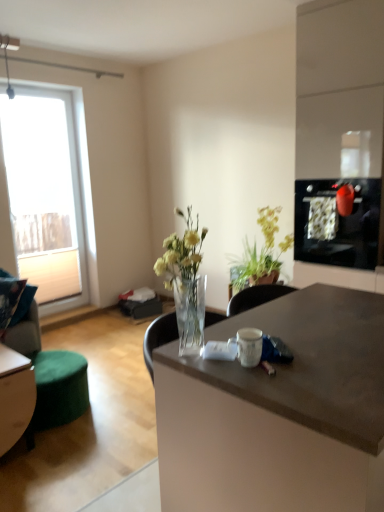
Question: Can you confirm if matte black oven at right is taller than white matte coffee cup at center?

Choices:
 (A) yes
 (B) no

Answer: (A)

Question: Considering the relative sizes of matte black oven at right and white matte coffee cup at center in the image provided, is matte black oven at right bigger than white matte coffee cup at center?

Choices:
 (A) yes
 (B) no

Answer: (A)

Question: Does matte black oven at right have a smaller size compared to white matte coffee cup at center?

Choices:
 (A) no
 (B) yes

Answer: (A)

Question: Are matte black oven at right and white matte coffee cup at center beside each other?

Choices:
 (A) yes
 (B) no

Answer: (B)

Question: Does matte black oven at right appear on the left side of white matte coffee cup at center?

Choices:
 (A) yes
 (B) no

Answer: (B)

Question: From a real-world perspective, is matte black oven at right under white matte coffee cup at center?

Choices:
 (A) no
 (B) yes

Answer: (A)

Question: Is black glass screen door at upper right at the back of green fabric ottoman at lower left?

Choices:
 (A) no
 (B) yes

Answer: (A)

Question: Can you confirm if green fabric ottoman at lower left is bigger than black glass screen door at upper right?

Choices:
 (A) no
 (B) yes

Answer: (A)

Question: Considering the relative sizes of green fabric ottoman at lower left and black glass screen door at upper right in the image provided, is green fabric ottoman at lower left taller than black glass screen door at upper right?

Choices:
 (A) yes
 (B) no

Answer: (B)

Question: Is green fabric ottoman at lower left positioned before black glass screen door at upper right?

Choices:
 (A) no
 (B) yes

Answer: (B)

Question: Can you confirm if green fabric ottoman at lower left is shorter than black glass screen door at upper right?

Choices:
 (A) no
 (B) yes

Answer: (B)

Question: Is green fabric ottoman at lower left smaller than black glass screen door at upper right?

Choices:
 (A) yes
 (B) no

Answer: (A)

Question: Can you confirm if black glass screen door at upper right is shorter than matte brown desk at center?

Choices:
 (A) yes
 (B) no

Answer: (A)